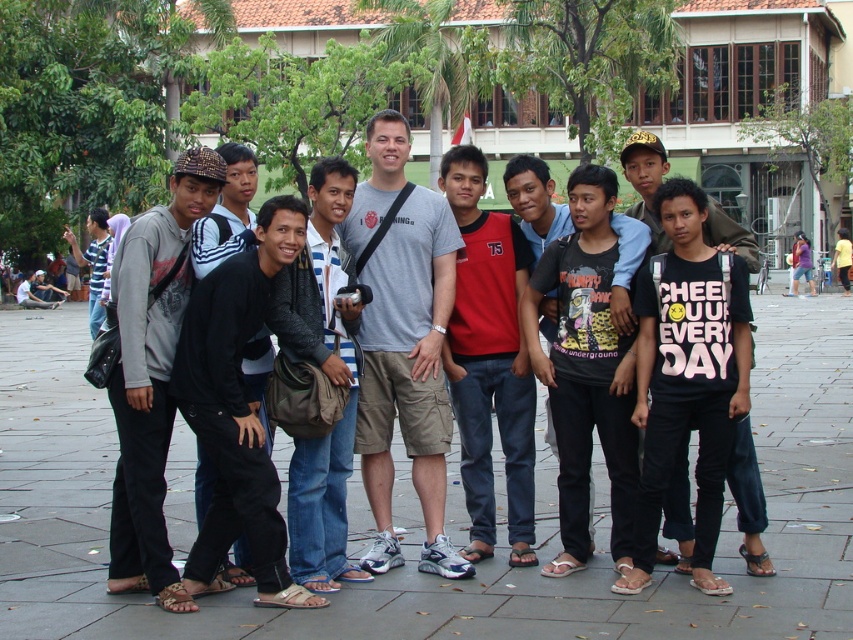
You are a photographer trying to capture a group photo of the red cotton shirt at center and the leather jacket at center. Since you want to ensure both subjects are visible in the frame, which subject should you position on the left side of the camera to include both?

To include both the red cotton shirt at center and the leather jacket at center in the frame, position the leather jacket at center on the left side of the camera since the red cotton shirt at center is to the right of it.

You are a photographer trying to capture a photo of the red cotton shirt at center without including the matte gray hoodie at left in the frame. Based on their positions, is this possible?

Answer: The matte gray hoodie at left is below the red cotton shirt at center, so if you position your camera to focus on the upper part of the red cotton shirt at center and avoid the lower area where the matte gray hoodie at left is located, it should be possible to exclude the matte gray hoodie at left from the frame.